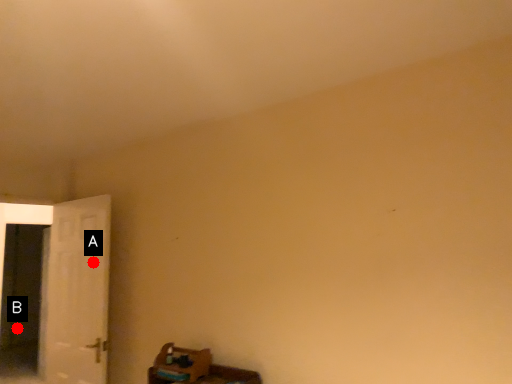
Question: Two points are circled on the image, labeled by A and B beside each circle. Which point is closer to the camera?

Choices:
 (A) A is closer
 (B) B is closer

Answer: (A)